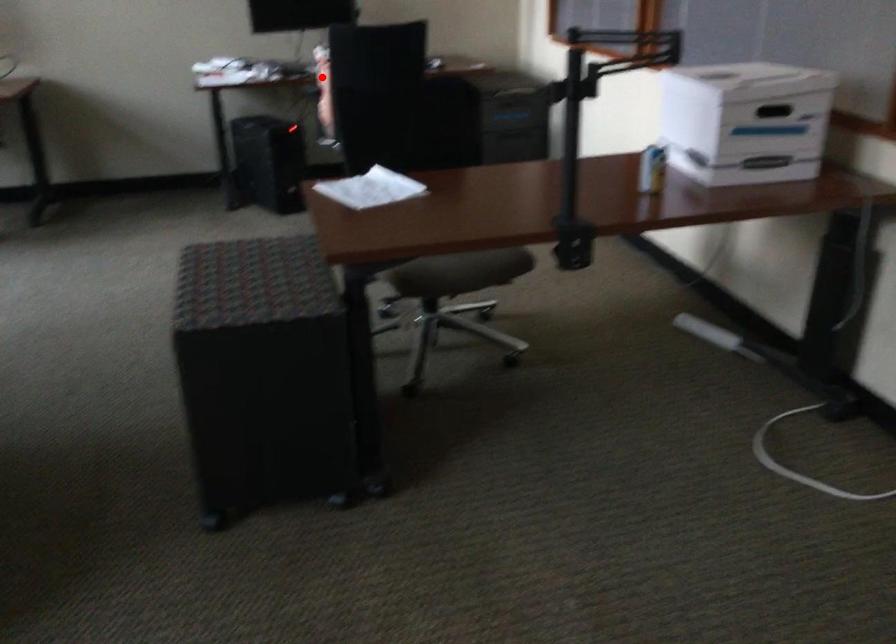
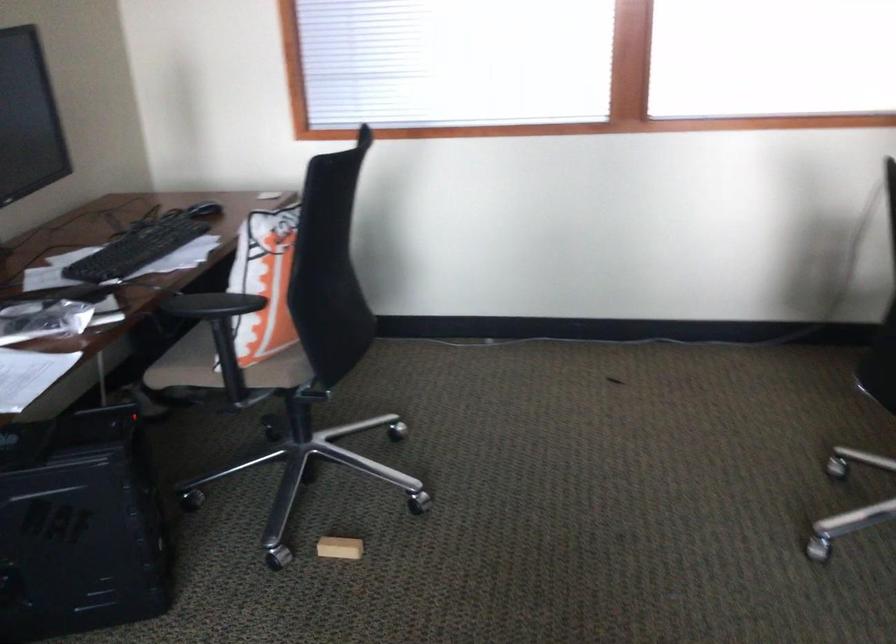
Question: A red point is marked in image1. In image2, is the corresponding 3D point closer to the camera or farther? Reply with the corresponding letter.

Choices:
 (A) The corresponding 3D point is closer.
 (B) The corresponding 3D point is farther.

Answer: (A)